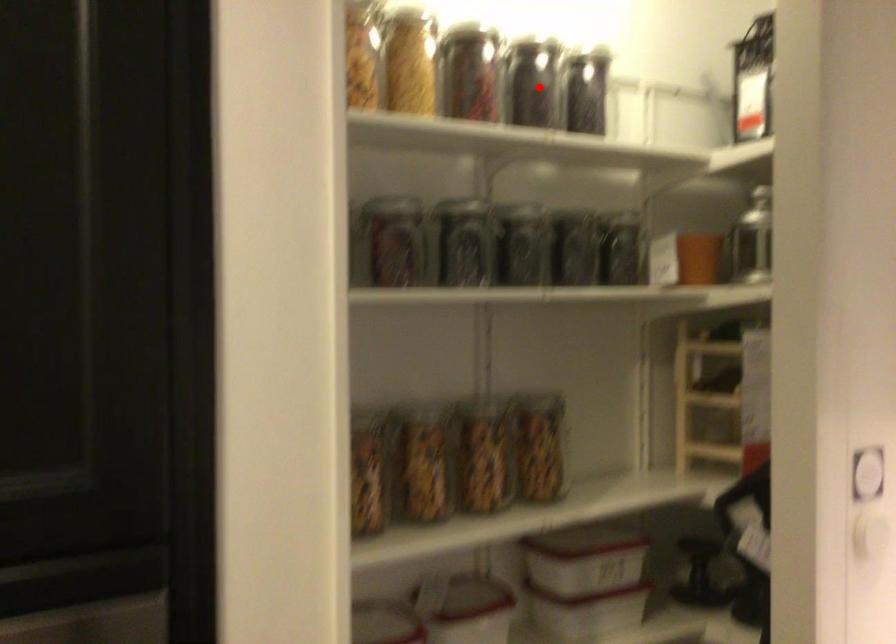
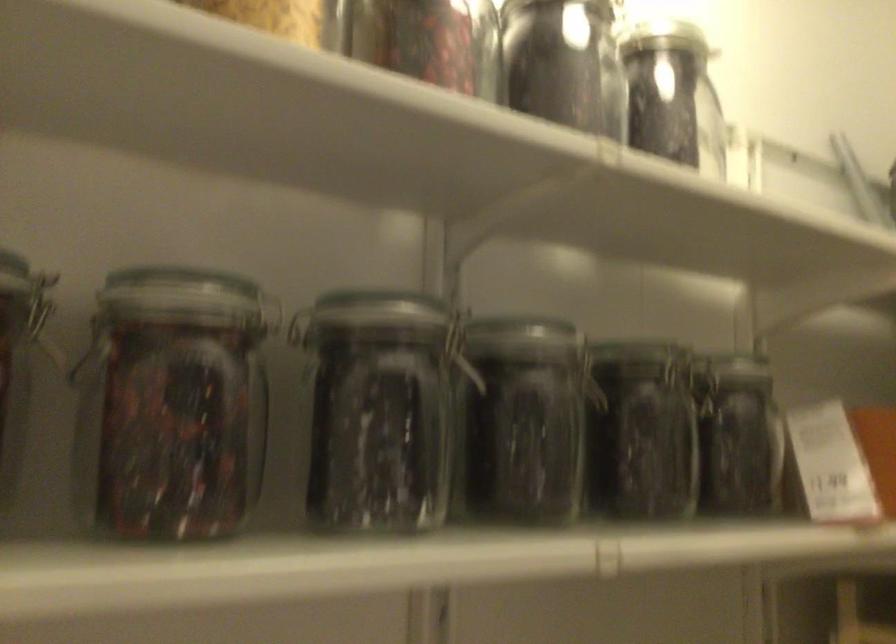
Find the pixel in the second image that matches the highlighted location in the first image.

(564, 64)